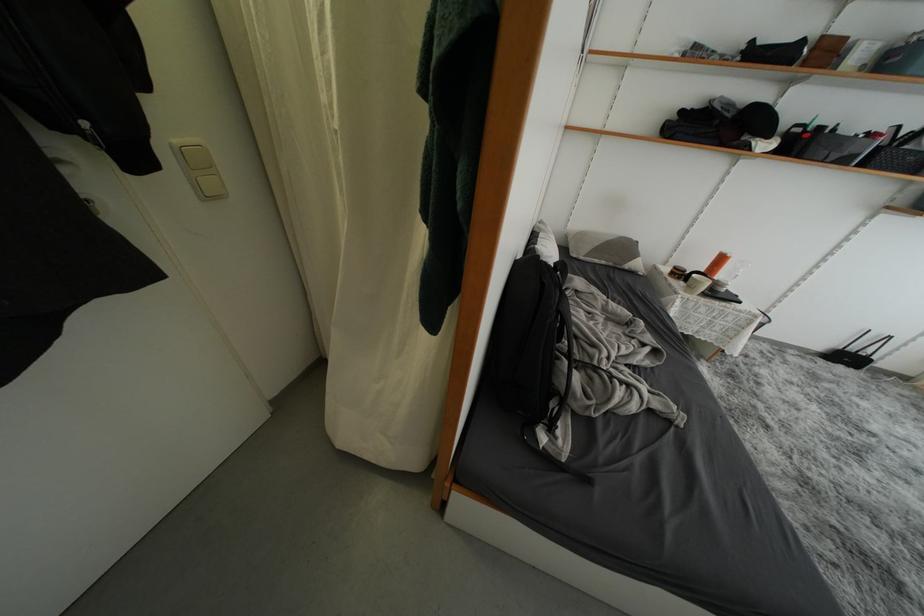
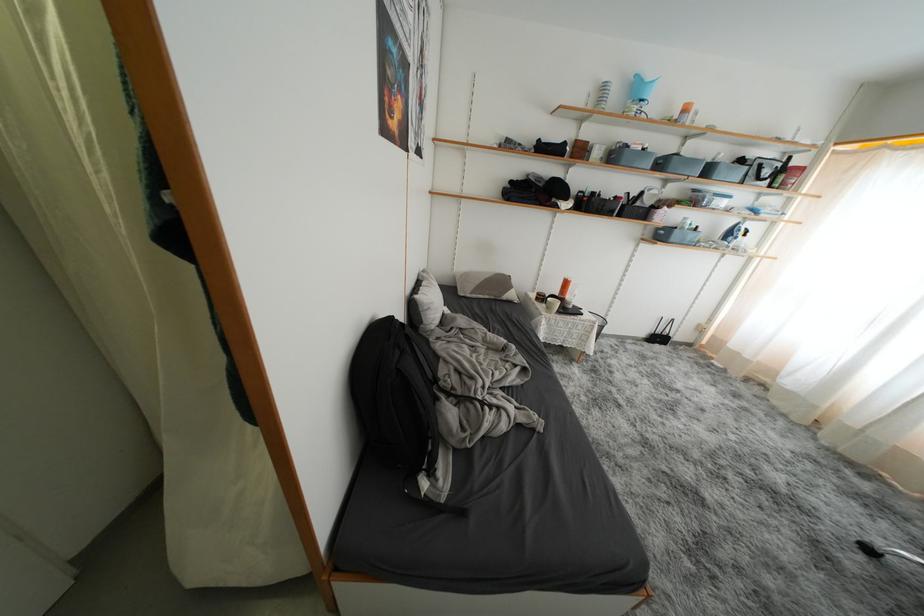
Which direction would the cameraman need to move to produce the second image?

The cameraman moved toward right, backward.